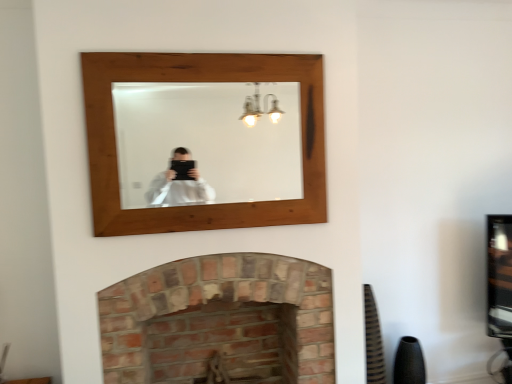
Locate an element on the screen. wooden mirror at upper center is located at coordinates (207, 143).

The image size is (512, 384). Describe the element at coordinates (207, 143) in the screenshot. I see `wooden mirror at upper center` at that location.

Describe the element at coordinates (205, 301) in the screenshot. I see `brick fireplace at lower center` at that location.

This screenshot has width=512, height=384. I want to click on brick fireplace at lower center, so click(x=205, y=301).

The width and height of the screenshot is (512, 384). In order to click on wooden mirror at upper center in this screenshot , I will do `click(207, 143)`.

Between brick fireplace at lower center and wooden mirror at upper center, which one appears on the left side from the viewer's perspective?

From the viewer's perspective, wooden mirror at upper center appears more on the left side.

Based on the photo, which object is closer to the camera, brick fireplace at lower center or wooden mirror at upper center?

wooden mirror at upper center.

Is point (316, 356) farther from viewer compared to point (155, 131)?

No, (316, 356) is in front of (155, 131).

From the image's perspective, who appears lower, brick fireplace at lower center or wooden mirror at upper center?

brick fireplace at lower center appears lower in the image.

From a real-world perspective, is brick fireplace at lower center under wooden mirror at upper center?

Yes.

Is brick fireplace at lower center thinner than wooden mirror at upper center?

No, brick fireplace at lower center is not thinner than wooden mirror at upper center.

Considering the sizes of objects brick fireplace at lower center and wooden mirror at upper center in the image provided, who is taller, brick fireplace at lower center or wooden mirror at upper center?

brick fireplace at lower center is taller.

Which of these two, brick fireplace at lower center or wooden mirror at upper center, is bigger?

With larger size is brick fireplace at lower center.

Can we say brick fireplace at lower center lies outside wooden mirror at upper center?

brick fireplace at lower center is positioned outside wooden mirror at upper center.

Is brick fireplace at lower center not near wooden mirror at upper center?

Yes, brick fireplace at lower center and wooden mirror at upper center are located far from each other.

Based on the photo, could you tell me if brick fireplace at lower center is facing wooden mirror at upper center?

No, brick fireplace at lower center does not turn towards wooden mirror at upper center.

What's the angular difference between brick fireplace at lower center and wooden mirror at upper center's facing directions?

There is a 0.481-degree angle between the facing directions of brick fireplace at lower center and wooden mirror at upper center.

Locate an element on the screen. fireplace below the wooden mirror at upper center (from the image's perspective) is located at coordinates (205, 301).

In the image, is wooden mirror at upper center on the left side or the right side of brick fireplace at lower center?

In the image, wooden mirror at upper center appears on the left side of brick fireplace at lower center.

Is wooden mirror at upper center closer to camera compared to brick fireplace at lower center?

Yes, wooden mirror at upper center is closer to the camera.

Is point (268, 87) farther from camera compared to point (199, 273)?

Yes, it is behind point (199, 273).

From the image's perspective, does wooden mirror at upper center appear higher than brick fireplace at lower center?

Correct, wooden mirror at upper center appears higher than brick fireplace at lower center in the image.

From a real-world perspective, which object stands above the other?

wooden mirror at upper center, from a real-world perspective.

Which of these two, wooden mirror at upper center or brick fireplace at lower center, is wider?

brick fireplace at lower center.

From their relative heights in the image, would you say wooden mirror at upper center is taller or shorter than brick fireplace at lower center?

In the image, wooden mirror at upper center appears to be shorter than brick fireplace at lower center.

Which of these two, wooden mirror at upper center or brick fireplace at lower center, is smaller?

wooden mirror at upper center is smaller.

Would you say brick fireplace at lower center is part of wooden mirror at upper center's contents?

Definitely not — brick fireplace at lower center is not inside wooden mirror at upper center.

Is wooden mirror at upper center touching brick fireplace at lower center?

There is a gap between wooden mirror at upper center and brick fireplace at lower center.

Is wooden mirror at upper center facing towards brick fireplace at lower center?

No, wooden mirror at upper center is not oriented towards brick fireplace at lower center.

How far apart are wooden mirror at upper center and brick fireplace at lower center?

They are 3.84 feet apart.

Image resolution: width=512 pixels, height=384 pixels. What are the coordinates of `mirror in front of the brick fireplace at lower center` in the screenshot? It's located at (207, 143).

Identify the location of mirror on the left of brick fireplace at lower center. The width and height of the screenshot is (512, 384). (207, 143).

You are a GUI agent. You are given a task and a screenshot of the screen. Output one action in this format:
    pyautogui.click(x=<x>, y=<y>)
    Task: Click on the fireplace below the wooden mirror at upper center (from a real-world perspective)
    
    Given the screenshot: What is the action you would take?
    pyautogui.click(x=205, y=301)